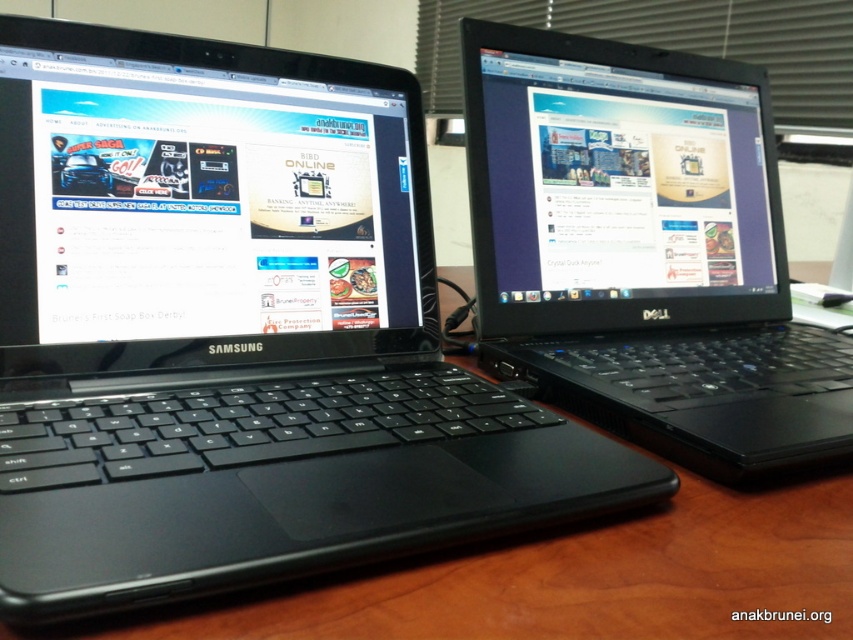
Question: Which point is farther from the camera taking this photo?

Choices:
 (A) (20, 170)
 (B) (747, 12)

Answer: (B)

Question: Among these objects, which one is nearest to the camera?

Choices:
 (A) matte black screen at upper center
 (B) black plastic laptop at center

Answer: (B)

Question: Observing the image, what is the correct spatial positioning of matte black laptop at left in reference to black plastic laptop at center?

Choices:
 (A) left
 (B) right

Answer: (A)

Question: Where is matte black laptop at left located in relation to black plastic laptop at center in the image?

Choices:
 (A) left
 (B) right

Answer: (A)

Question: Considering the real-world distances, which object is farthest from the matte black laptop at left?

Choices:
 (A) matte black screen at upper center
 (B) black plastic laptop at center

Answer: (A)

Question: Where is matte black laptop at left located in relation to matte black screen at upper center in the image?

Choices:
 (A) right
 (B) left

Answer: (B)